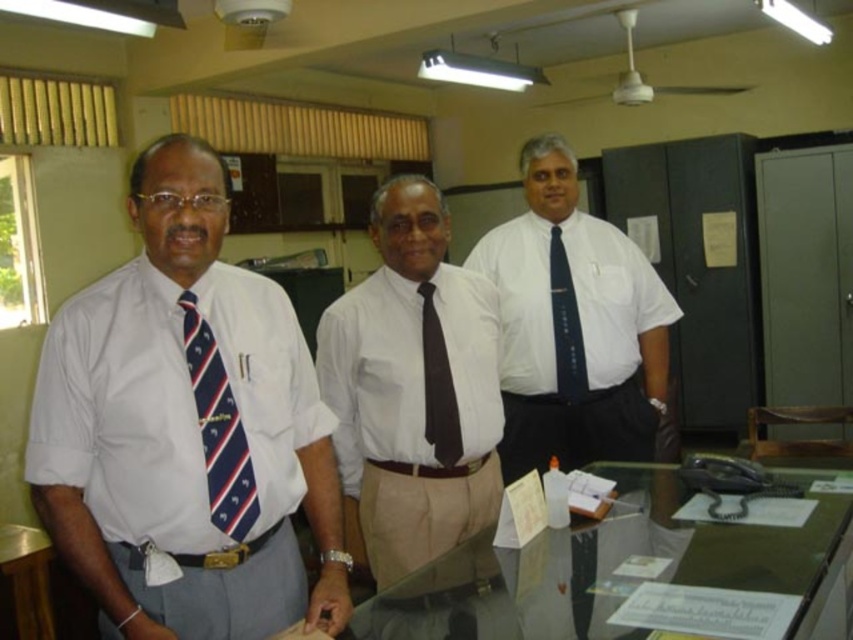
Question: Which of these objects is positioned farthest from the brown matte tie at center?

Choices:
 (A) blue striped tie at center
 (B) white smooth shirt at center
 (C) glossy wood table at lower left

Answer: (C)

Question: Which point is closer to the camera?

Choices:
 (A) navy blue striped tie at left
 (B) white shirt at left
 (C) black silk tie at center

Answer: (B)

Question: Can you confirm if navy blue striped tie at left is positioned below black silk tie at center?

Choices:
 (A) yes
 (B) no

Answer: (A)

Question: Can you confirm if white shirt at left is positioned above navy blue striped tie at left?

Choices:
 (A) yes
 (B) no

Answer: (A)

Question: Can you confirm if glossy wood table at lower left is thinner than black silk tie at center?

Choices:
 (A) no
 (B) yes

Answer: (A)

Question: Based on their relative distances, which object is farther from the brown matte tie at center?

Choices:
 (A) navy blue striped tie at left
 (B) white smooth shirt at center

Answer: (A)